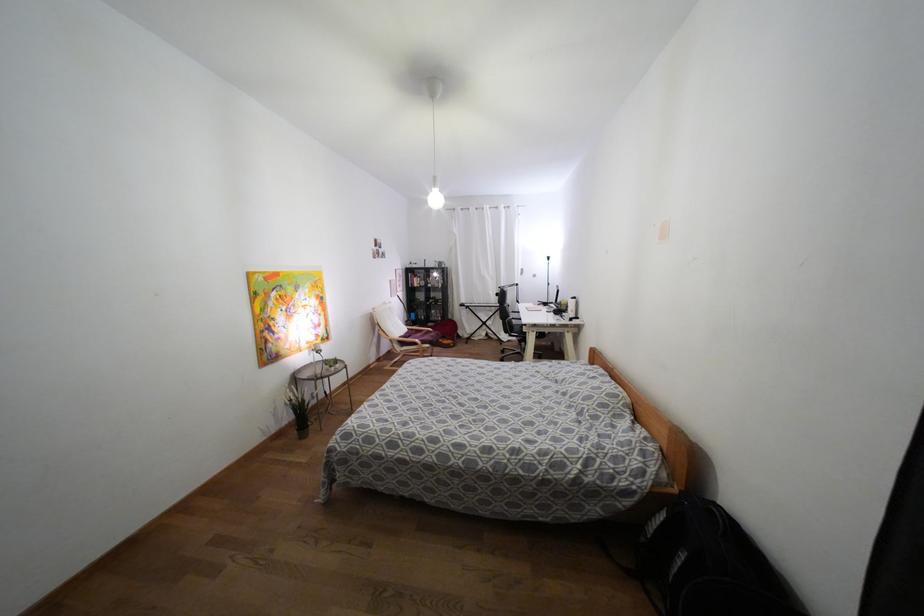
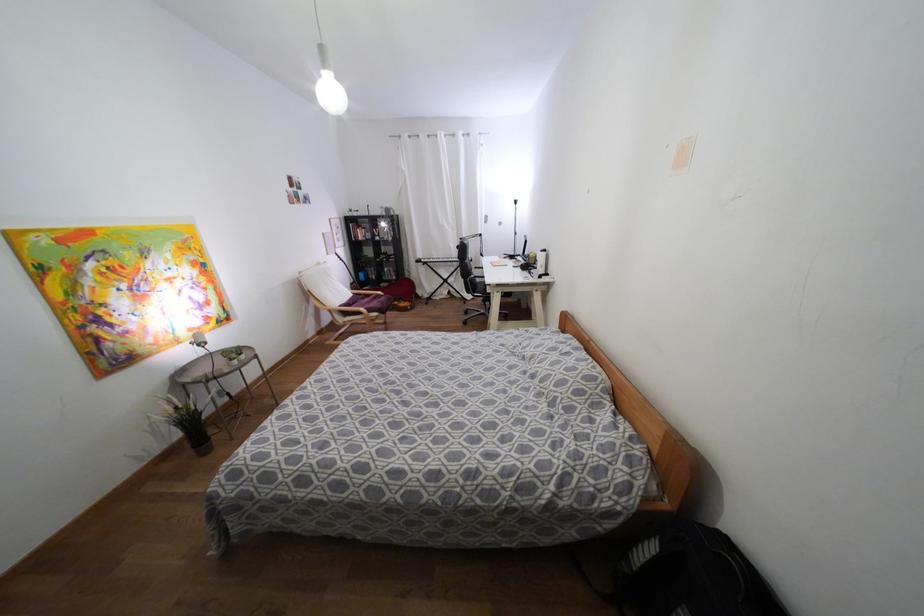
The point at (x=652, y=515) is marked in the first image. Where is the corresponding point in the second image?

(640, 541)